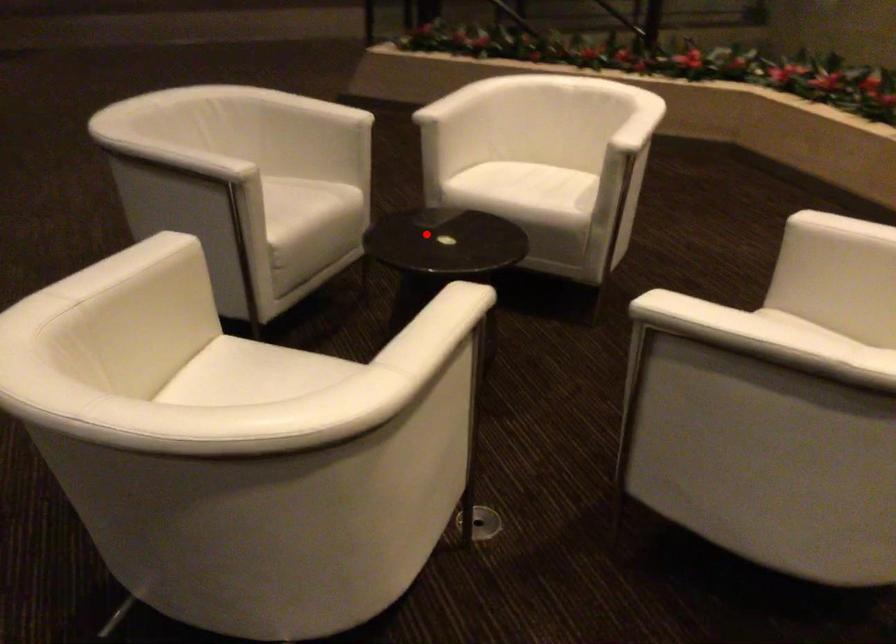
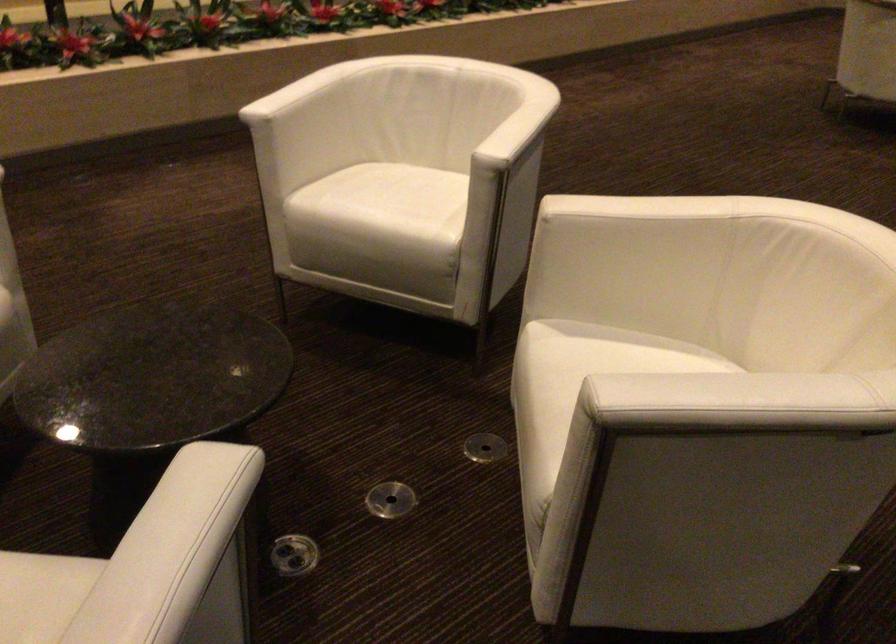
Question: I am providing you with two images of the same scene from different viewpoints. Given a red point in image1, look at the same physical point in image2. Is it:

Choices:
 (A) Closer to the viewpoint
 (B) Farther from the viewpoint

Answer: (A)